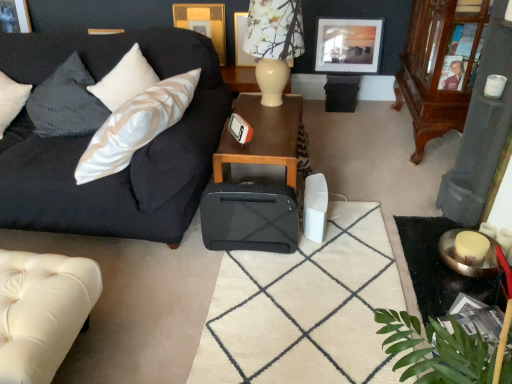
Find the location of a particular element. This screenshot has width=512, height=384. free location in front of white ceramic lamp at upper center is located at coordinates (271, 128).